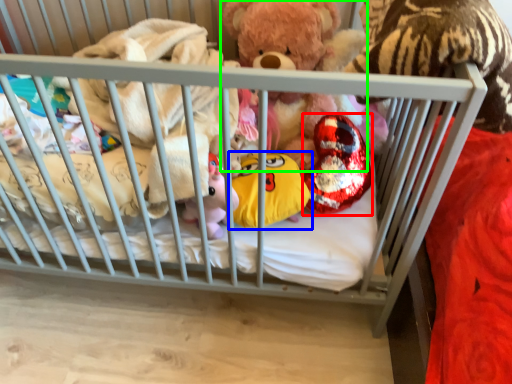
Question: Considering the real-world distances, which object is closest to toy (highlighted by a red box)? toy (highlighted by a blue box) or teddy bear (highlighted by a green box).

Choices:
 (A) toy
 (B) teddy bear

Answer: (A)